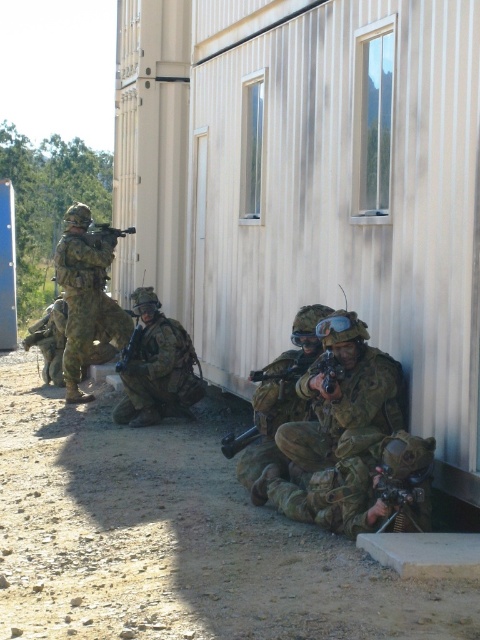
Question: Which object is the farthest from the matte black rifle at lower right?

Choices:
 (A) matte black rifle at lower center
 (B) matte black rifle at upper left
 (C) camouflage fabric helmet at center
 (D) matte black rifle at center

Answer: (B)

Question: Is camouflage fabric helmet at center above camouflage fabric helmet at lower right?

Choices:
 (A) yes
 (B) no

Answer: (A)

Question: Which point is farther from the camera taking this photo?

Choices:
 (A) (143, 406)
 (B) (126, 348)

Answer: (B)

Question: Is camouflage fabric helmet at center positioned behind matte black rifle at upper left?

Choices:
 (A) no
 (B) yes

Answer: (A)

Question: Estimate the real-world distances between objects in this image. Which object is closer to the camouflage fabric helmet at lower right?

Choices:
 (A) camouflage fabric helmet at center
 (B) camouflage fabric uniform at center

Answer: (A)

Question: Is camouflage fabric helmet at center in front of matte black rifle at center?

Choices:
 (A) no
 (B) yes

Answer: (B)